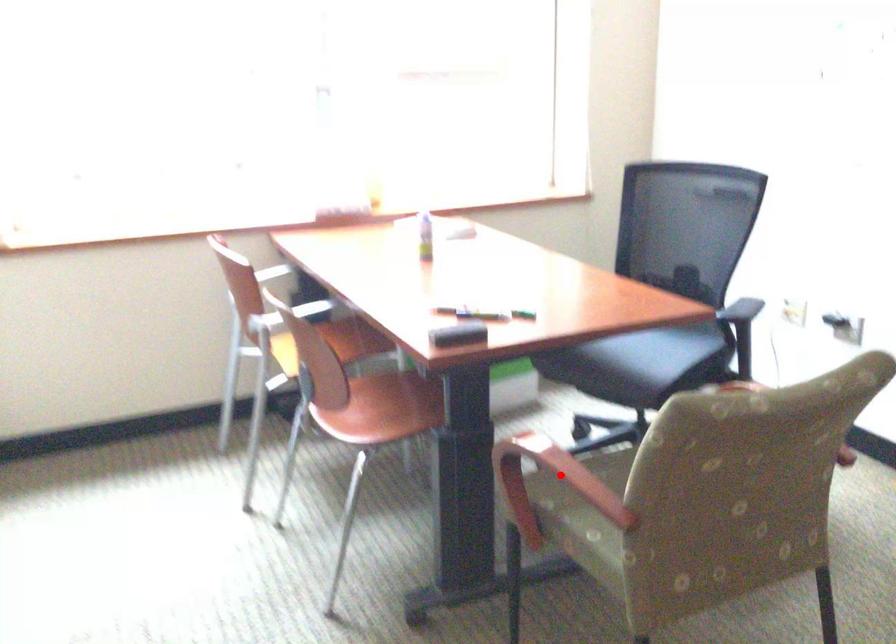
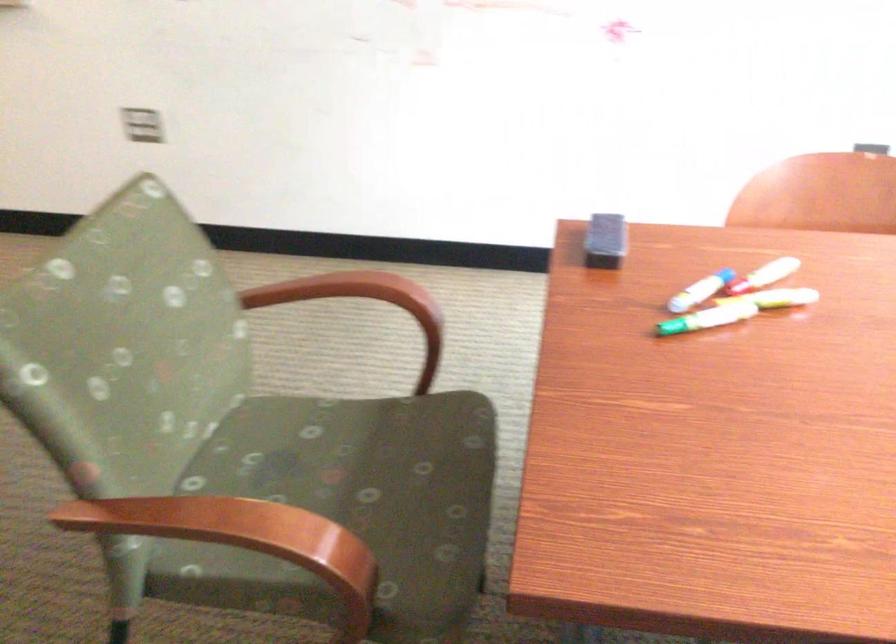
Question: I am providing you with two images of the same scene from different viewpoints. In image1, a red point is highlighted. Considering the same 3D point in image2, which of the following is correct?

Choices:
 (A) It is closer
 (B) It is farther

Answer: (B)